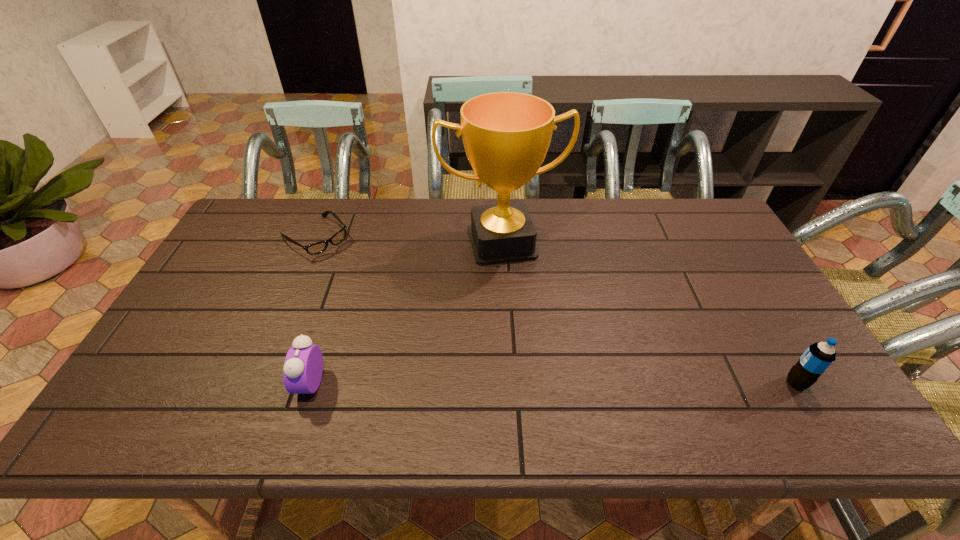
Where is `free spot on the desktop that is between the alarm clock and the soda bottle and is positioned on the front-facing side of the third object from left to right`? This screenshot has height=540, width=960. free spot on the desktop that is between the alarm clock and the soda bottle and is positioned on the front-facing side of the third object from left to right is located at coordinates (545, 383).

What are the coordinates of `free spot on the desktop that is between the third tallest object and the third shortest object and is positioned on the front-facing side of the spectacles` in the screenshot? It's located at (481, 383).